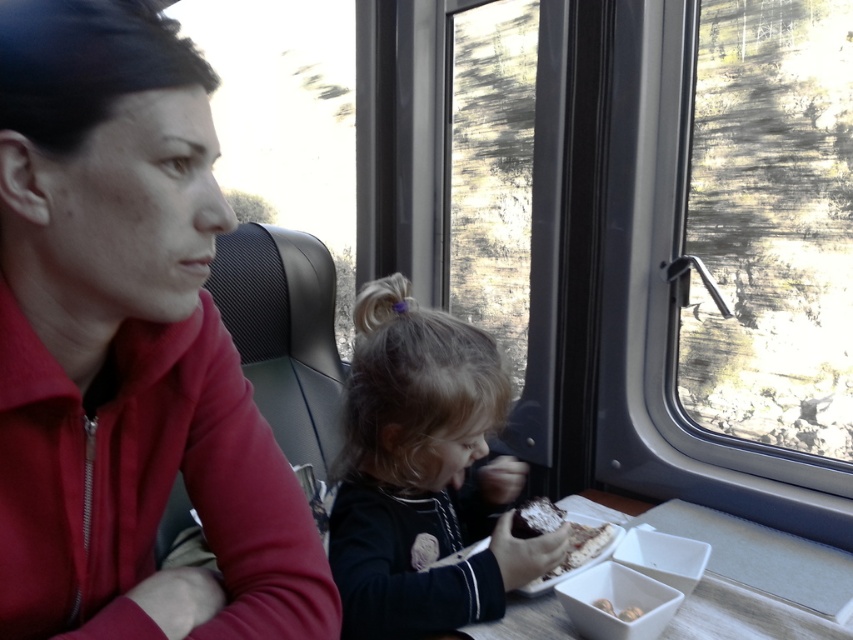
Can you confirm if dark brown hair at center is positioned below crumbly brown bread at lower center?

No.

Between point (444, 349) and point (521, 508), which one is positioned in front?

Point (444, 349) is in front.

This screenshot has height=640, width=853. Find the location of `dark brown hair at center`. dark brown hair at center is located at coordinates click(x=424, y=474).

Does point (151, 628) come in front of point (376, 332)?

Yes, it is.

Can you confirm if matte red jacket at left is thinner than dark brown hair at center?

Correct, matte red jacket at left's width is less than dark brown hair at center's.

Between point (4, 394) and point (381, 492), which one is positioned in front?

Point (4, 394) is more forward.

Where is `matte red jacket at left`? This screenshot has height=640, width=853. matte red jacket at left is located at coordinates (125, 340).

Can you confirm if matte red jacket at left is positioned below transparent glass window at right?

Yes, matte red jacket at left is below transparent glass window at right.

Where is `matte red jacket at left`? Image resolution: width=853 pixels, height=640 pixels. matte red jacket at left is located at coordinates (125, 340).